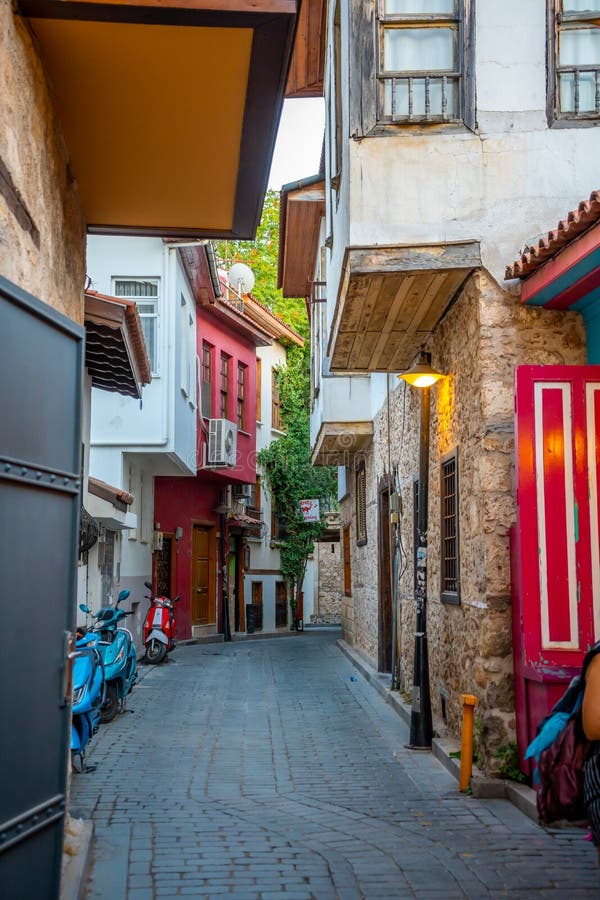
Where is `sconce`? Image resolution: width=600 pixels, height=900 pixels. sconce is located at coordinates (427, 380).